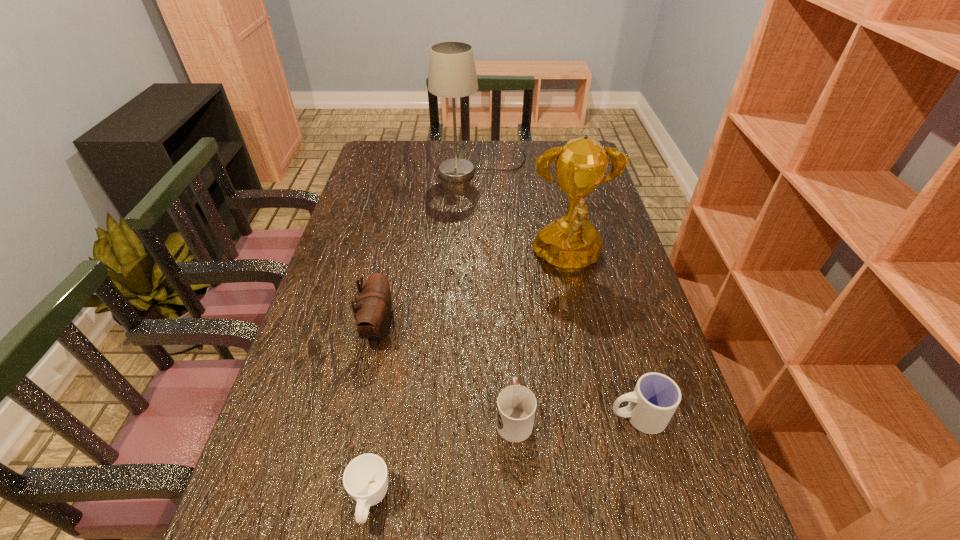
You are a GUI agent. You are given a task and a screenshot of the screen. Output one action in this format:
    pyautogui.click(x=<x>, y=<y>)
    Task: Click on the free space in the image that satisfies the following two spatial constraints: 1. with the flap open on the pouch; 2. on the handle side of the second cup from left to right
    The width and height of the screenshot is (960, 540).
    Given the screenshot: What is the action you would take?
    pyautogui.click(x=361, y=417)